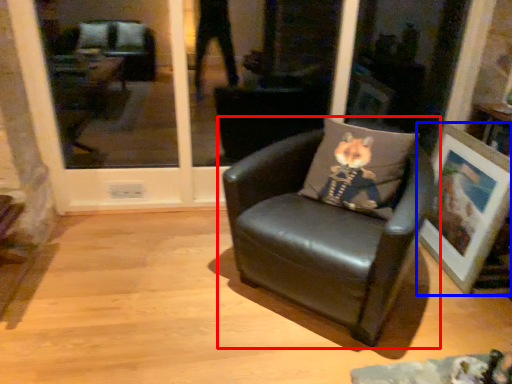
Question: Which object appears closest to the camera in this image, chair (highlighted by a red box) or picture frame (highlighted by a blue box)?

Choices:
 (A) chair
 (B) picture frame

Answer: (A)